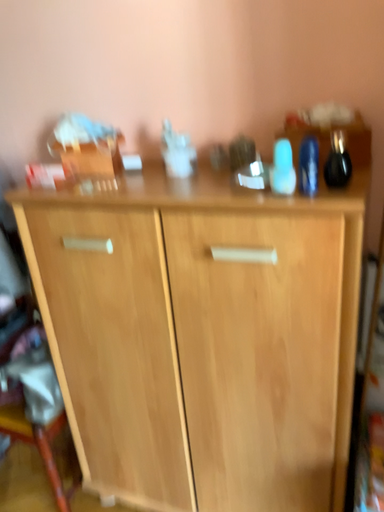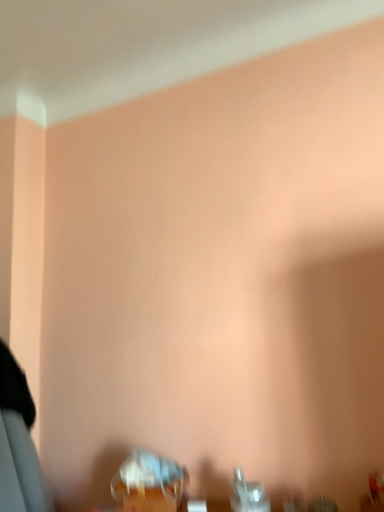
Question: How did the camera likely rotate when shooting the video?

Choices:
 (A) rotated upward
 (B) rotated downward

Answer: (A)